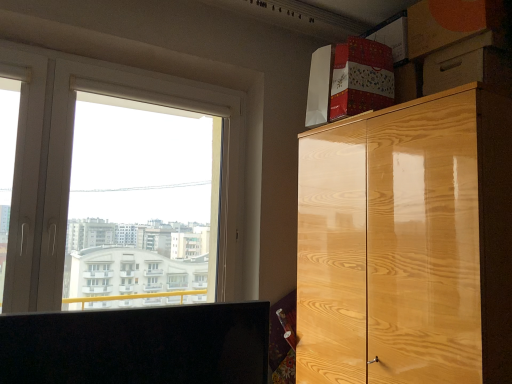
Question: Does orange cardboard box at upper right appear on the left side of glossy wood cabinet at upper right?

Choices:
 (A) no
 (B) yes

Answer: (A)

Question: Is orange cardboard box at upper right thinner than glossy wood cabinet at upper right?

Choices:
 (A) no
 (B) yes

Answer: (B)

Question: Considering the relative sizes of orange cardboard box at upper right and glossy wood cabinet at upper right in the image provided, is orange cardboard box at upper right taller than glossy wood cabinet at upper right?

Choices:
 (A) yes
 (B) no

Answer: (B)

Question: Is orange cardboard box at upper right beside glossy wood cabinet at upper right?

Choices:
 (A) no
 (B) yes

Answer: (A)

Question: Considering the relative sizes of orange cardboard box at upper right and glossy wood cabinet at upper right in the image provided, is orange cardboard box at upper right wider than glossy wood cabinet at upper right?

Choices:
 (A) yes
 (B) no

Answer: (B)

Question: Is white plastic window at upper left inside or outside of orange cardboard box at upper right?

Choices:
 (A) outside
 (B) inside

Answer: (A)

Question: Is point (47, 294) positioned closer to the camera than point (498, 26)?

Choices:
 (A) farther
 (B) closer

Answer: (A)

Question: In the image, is white plastic window at upper left positioned in front of or behind orange cardboard box at upper right?

Choices:
 (A) front
 (B) behind

Answer: (B)

Question: From a real-world perspective, is white plastic window at upper left physically located above or below orange cardboard box at upper right?

Choices:
 (A) above
 (B) below

Answer: (B)

Question: Which is correct: orange cardboard box at upper right is inside white plastic window at upper left, or outside of it?

Choices:
 (A) inside
 (B) outside

Answer: (B)

Question: Looking at the image, does orange cardboard box at upper right seem bigger or smaller compared to white plastic window at upper left?

Choices:
 (A) big
 (B) small

Answer: (B)

Question: Based on their positions, is orange cardboard box at upper right located to the left or right of white plastic window at upper left?

Choices:
 (A) right
 (B) left

Answer: (A)

Question: From a real-world perspective, is orange cardboard box at upper right physically located above or below white plastic window at upper left?

Choices:
 (A) below
 (B) above

Answer: (B)

Question: Do you think orange cardboard box at upper right is within glossy wood cabinet at upper right, or outside of it?

Choices:
 (A) inside
 (B) outside

Answer: (B)

Question: Considering their positions, is orange cardboard box at upper right located in front of or behind glossy wood cabinet at upper right?

Choices:
 (A) behind
 (B) front

Answer: (A)